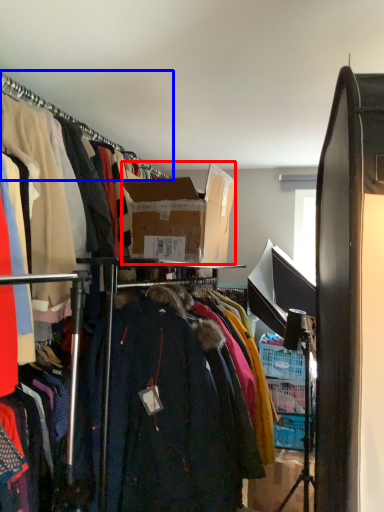
Question: Which object appears farthest to the camera in this image, box (highlighted by a red box) or hanger (highlighted by a blue box)?

Choices:
 (A) box
 (B) hanger

Answer: (A)